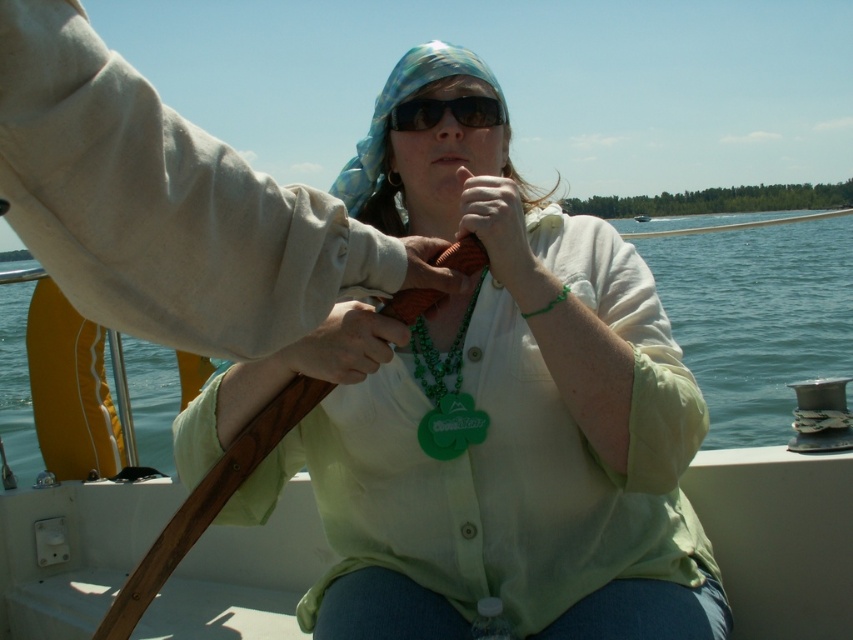
You are a fashion designer observing the woman on the boat. You need to decide which green accessory takes up more space on her outfit between the matte green shirt at center and the matte green necklace at center. Which one would you choose?

The matte green shirt at center is bigger than the matte green necklace at center, so the matte green shirt at center takes up more space on her outfit.

You are a photographer trying to capture a closeup shot of the matte brown object at center and sunglasses at center. Which object should you zoom in more on to ensure both are in frame without cropping?

The matte brown object at center has a lesser width compared to sunglasses at center, so you should zoom in more on the sunglasses at center to ensure both are in frame without cropping.